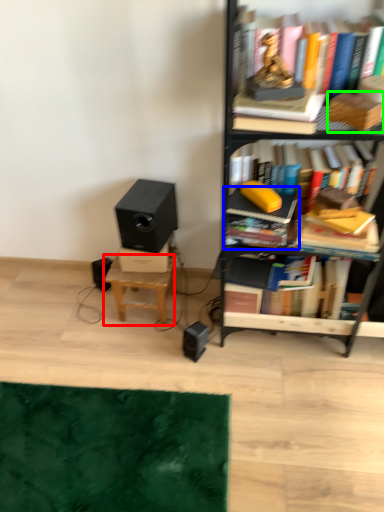
Question: Considering the real-world distances, which object is closest to stool (highlighted by a red box)? book (highlighted by a blue box) or paperback book (highlighted by a green box).

Choices:
 (A) book
 (B) paperback book

Answer: (A)